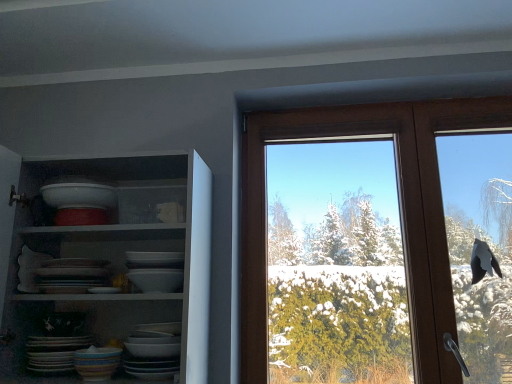
You are a GUI agent. You are given a task and a screenshot of the screen. Output one action in this format:
    pyautogui.click(x=<x>, y=<y>)
    Task: Click on the free space above matte ceramic platter at lower left (from a real-world perspective)
    This screenshot has width=512, height=384.
    Given the screenshot: What is the action you would take?
    pyautogui.click(x=59, y=336)